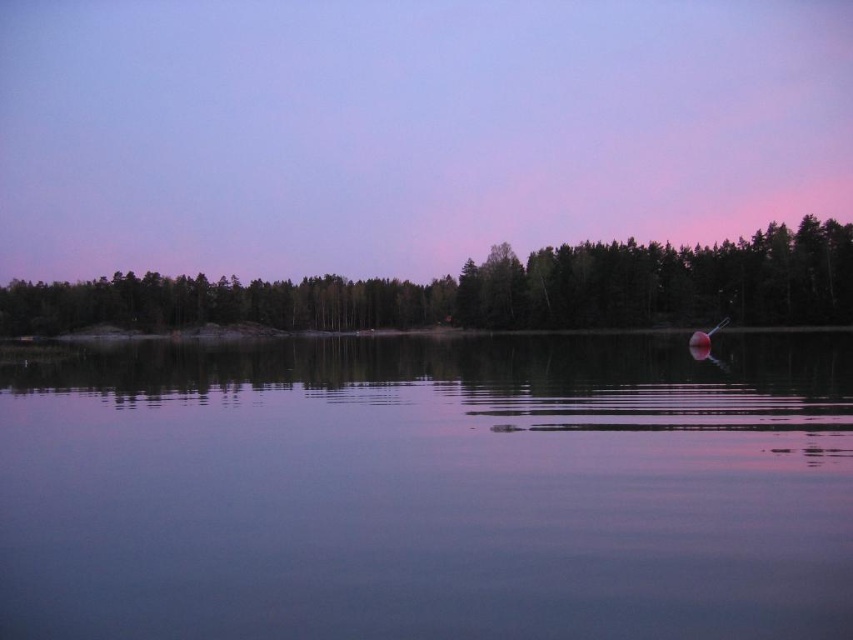
You are an artist painting the lakeside scene. You want to place the purple sky at upper center and the green matte tree at center in your painting. Which object should you paint first if you follow the left to right painting order?

You should paint the purple sky at upper center first because it is positioned on the left side of the green matte tree at center.